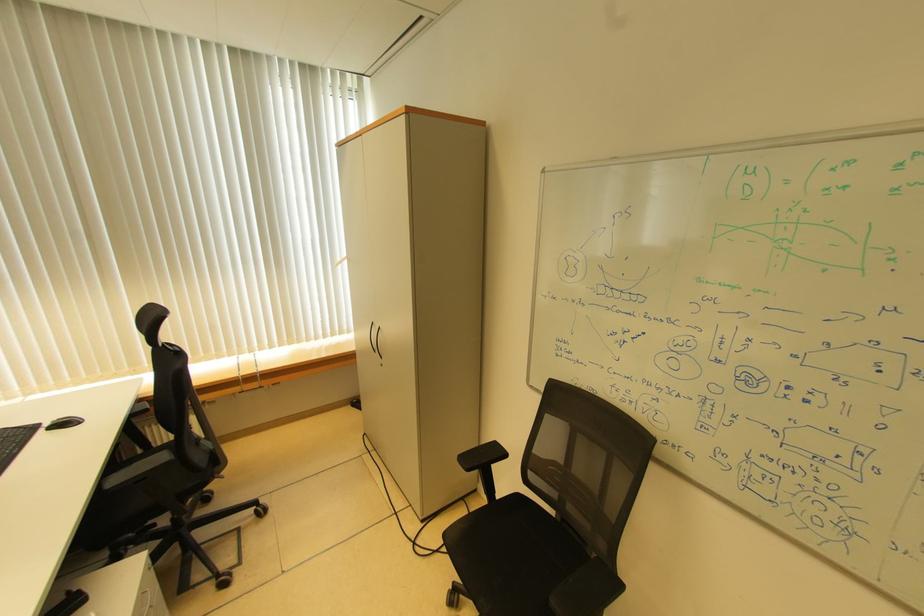
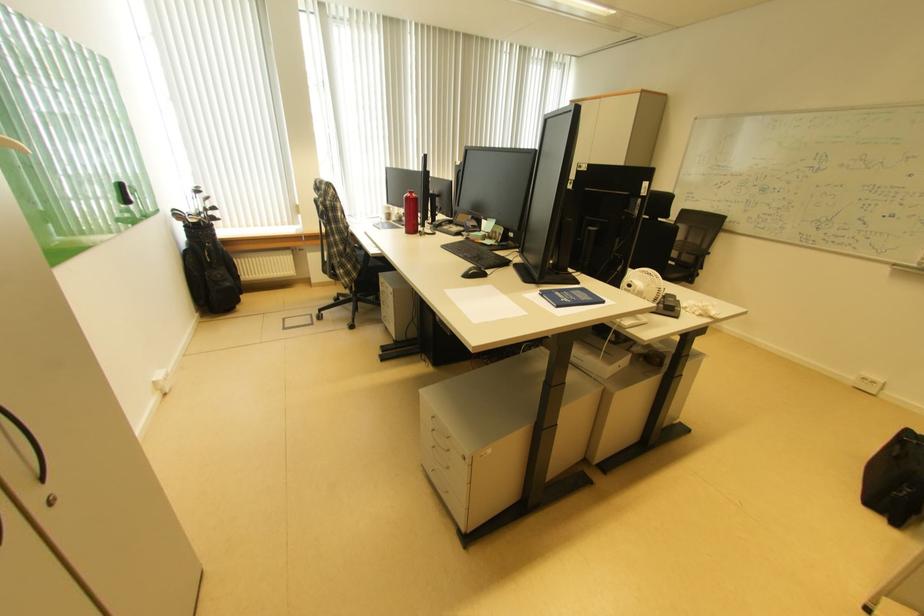
Which direction would the cameraman need to move to produce the second image?

The cameraman moved toward left, backward.